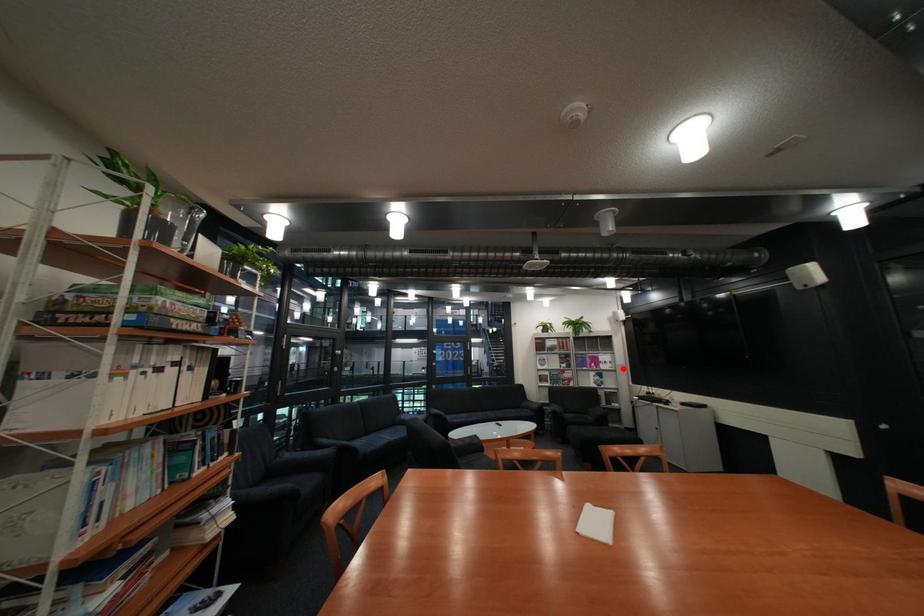
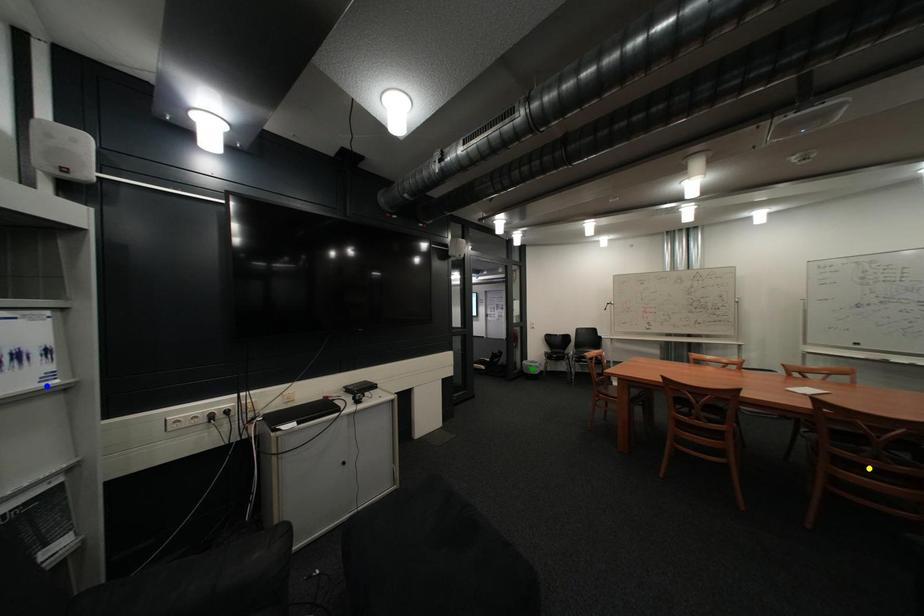
Question: I am providing you with two images of the same scene from different viewpoints. A red point is marked on the first image. You are given multiple points on the second image. Which point in image 2 is actually the same real-world point as the red point in image 1?

Choices:
 (A) blue point
 (B) green point
 (C) yellow point

Answer: (A)